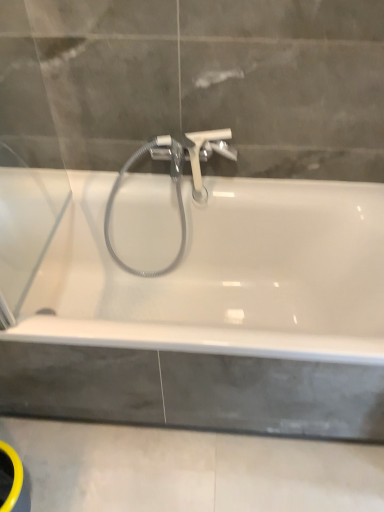
Question: Can you confirm if white glossy bathtub at center is wider than concreteroughbath edge at lower center?

Choices:
 (A) yes
 (B) no

Answer: (B)

Question: From a real-world perspective, does white glossy bathtub at center stand above concreteroughbath edge at lower center?

Choices:
 (A) no
 (B) yes

Answer: (B)

Question: Considering the relative sizes of white glossy bathtub at center and concreteroughbath edge at lower center in the image provided, is white glossy bathtub at center taller than concreteroughbath edge at lower center?

Choices:
 (A) no
 (B) yes

Answer: (B)

Question: Does white glossy bathtub at center have a smaller size compared to concreteroughbath edge at lower center?

Choices:
 (A) yes
 (B) no

Answer: (B)

Question: From the image's perspective, would you say white glossy bathtub at center is shown under concreteroughbath edge at lower center?

Choices:
 (A) no
 (B) yes

Answer: (A)

Question: From a real-world perspective, is white plastic tap at center positioned above or below white glossy bathtub at center?

Choices:
 (A) below
 (B) above

Answer: (B)

Question: Is point (201, 141) positioned closer to the camera than point (157, 378)?

Choices:
 (A) farther
 (B) closer

Answer: (A)

Question: In the image, is white plastic tap at center positioned in front of or behind white glossy bathtub at center?

Choices:
 (A) behind
 (B) front

Answer: (A)

Question: Is white plastic tap at center taller or shorter than white glossy bathtub at center?

Choices:
 (A) short
 (B) tall

Answer: (A)

Question: From the image's perspective, is concreteroughbath edge at lower center positioned above or below white plastic tap at center?

Choices:
 (A) above
 (B) below

Answer: (B)

Question: Considering their positions, is concreteroughbath edge at lower center located in front of or behind white plastic tap at center?

Choices:
 (A) front
 (B) behind

Answer: (A)

Question: In terms of size, does concreteroughbath edge at lower center appear bigger or smaller than white plastic tap at center?

Choices:
 (A) small
 (B) big

Answer: (A)

Question: Is point (324, 500) closer or farther from the camera than point (223, 131)?

Choices:
 (A) closer
 (B) farther

Answer: (A)

Question: Considering their positions, is white plastic tap at center located in front of or behind concreteroughbath edge at lower center?

Choices:
 (A) front
 (B) behind

Answer: (B)

Question: Looking at their shapes, would you say white plastic tap at center is wider or thinner than concreteroughbath edge at lower center?

Choices:
 (A) wide
 (B) thin

Answer: (B)